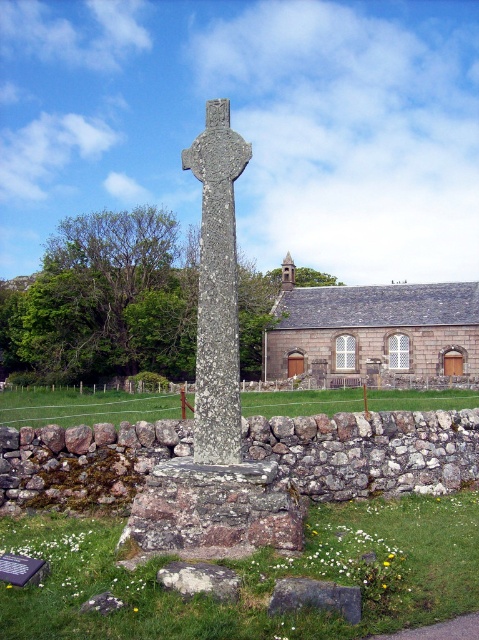
Question: Which object appears closest to the camera in this image?

Choices:
 (A) granite cross at center
 (B) rough stone cross at center
 (C) gray rough stone at lower center
 (D) gray stone church at center

Answer: (C)

Question: Is granite cross at center above gray stone church at center?

Choices:
 (A) no
 (B) yes

Answer: (B)

Question: Which point is farther to the camera?

Choices:
 (A) rough stone cross at center
 (B) gray rough stone at lower center
 (C) gray stone church at center
 (D) granite cross at center

Answer: (C)

Question: Is rough stone cross at center to the left of gray rough stone at lower center from the viewer's perspective?

Choices:
 (A) no
 (B) yes

Answer: (B)

Question: Estimate the real-world distances between objects in this image. Which object is farther from the granite cross at center?

Choices:
 (A) rough stone cross at center
 (B) gray rough stone at lower center
 (C) gray stone church at center

Answer: (C)

Question: Is gray stone church at center further to camera compared to gray rough stone at lower center?

Choices:
 (A) yes
 (B) no

Answer: (A)